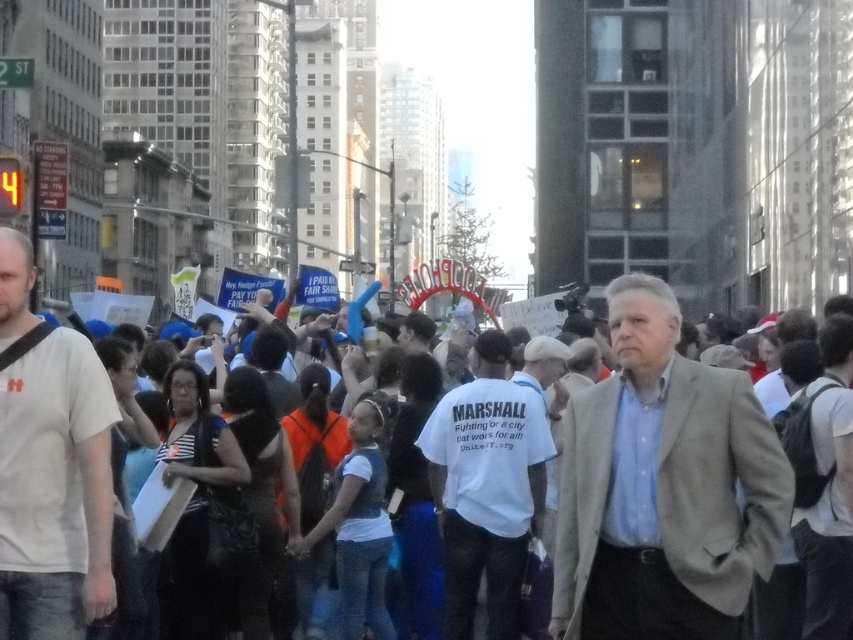
Question: Observing the image, what is the correct spatial positioning of white cotton t-shirt at left in reference to white cotton t-shirt at center?

Choices:
 (A) above
 (B) below

Answer: (A)

Question: Which object is the closest to the light gray suit at center?

Choices:
 (A) white cotton t-shirt at left
 (B) white cotton t-shirt at center

Answer: (B)

Question: Is light gray suit at center to the right of white cotton t-shirt at left from the viewer's perspective?

Choices:
 (A) no
 (B) yes

Answer: (B)

Question: Does white cotton t-shirt at left come behind white cotton t-shirt at center?

Choices:
 (A) no
 (B) yes

Answer: (A)

Question: Which of the following is the farthest from the observer?

Choices:
 (A) light gray suit at center
 (B) white cotton t-shirt at left
 (C) white cotton t-shirt at center

Answer: (C)

Question: Among these points, which one is nearest to the camera?

Choices:
 (A) (495, 586)
 (B) (770, 545)
 (C) (0, 614)

Answer: (C)